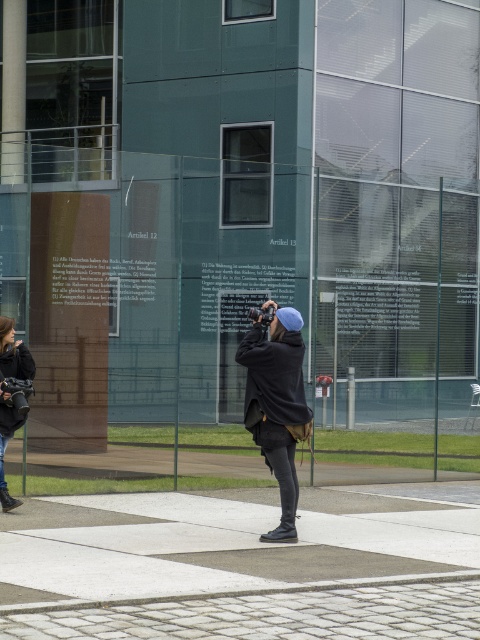
Can you confirm if matte black jacket at center is positioned above denim jacket at lower left?

Indeed, matte black jacket at center is positioned over denim jacket at lower left.

Which of these two, matte black jacket at center or denim jacket at lower left, stands taller?

Standing taller between the two is matte black jacket at center.

Locate an element on the screen. matte black jacket at center is located at coordinates (276, 403).

You are a GUI agent. You are given a task and a screenshot of the screen. Output one action in this format:
    pyautogui.click(x=<x>, y=<y>)
    Task: Click on the matte black jacket at center
    This screenshot has height=640, width=480.
    Given the screenshot: What is the action you would take?
    [x=276, y=403]